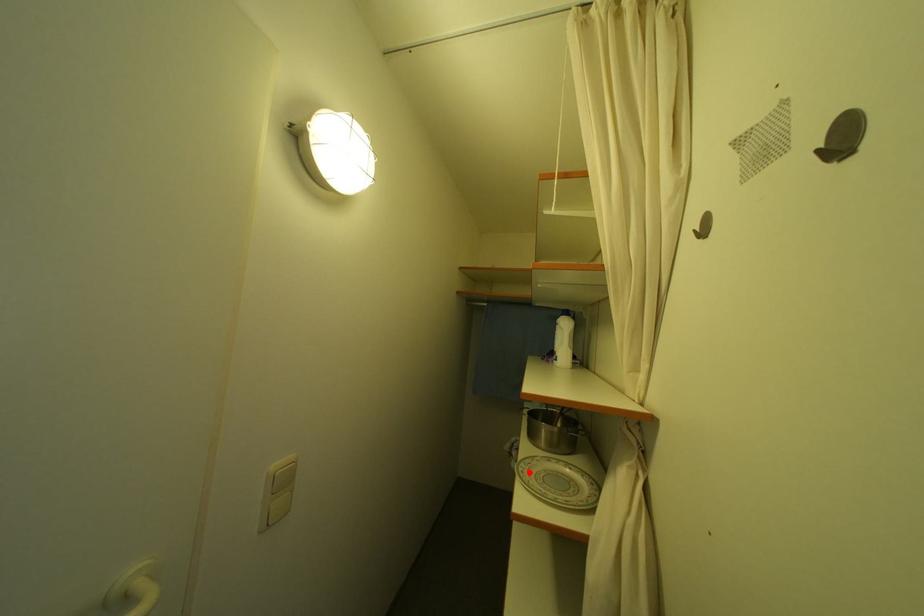
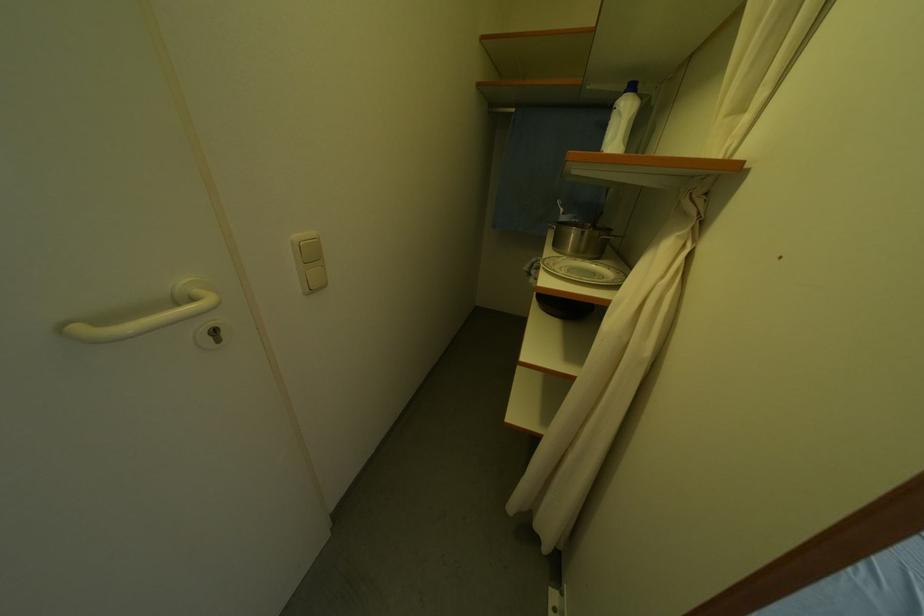
Find the pixel in the second image that matches the highlighted location in the first image.

(554, 265)